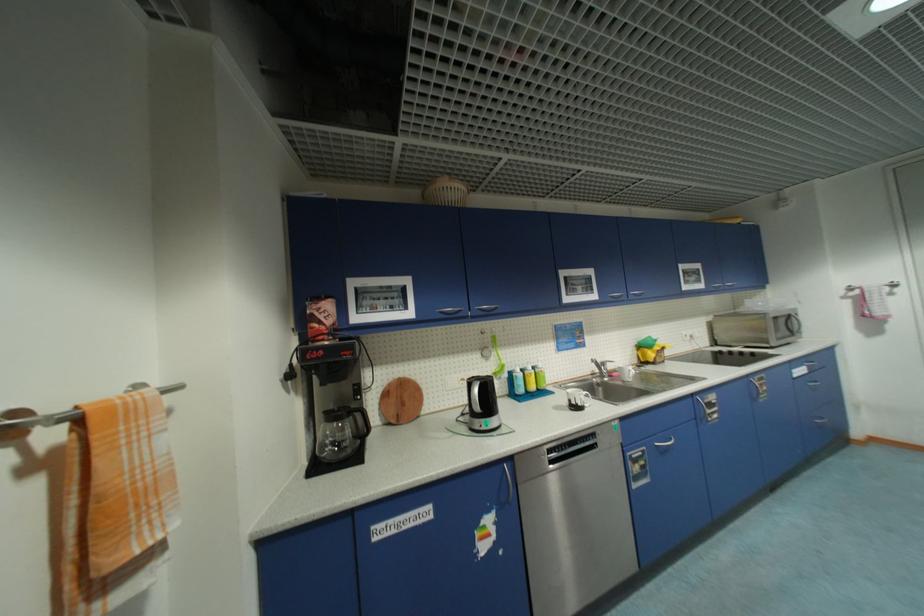
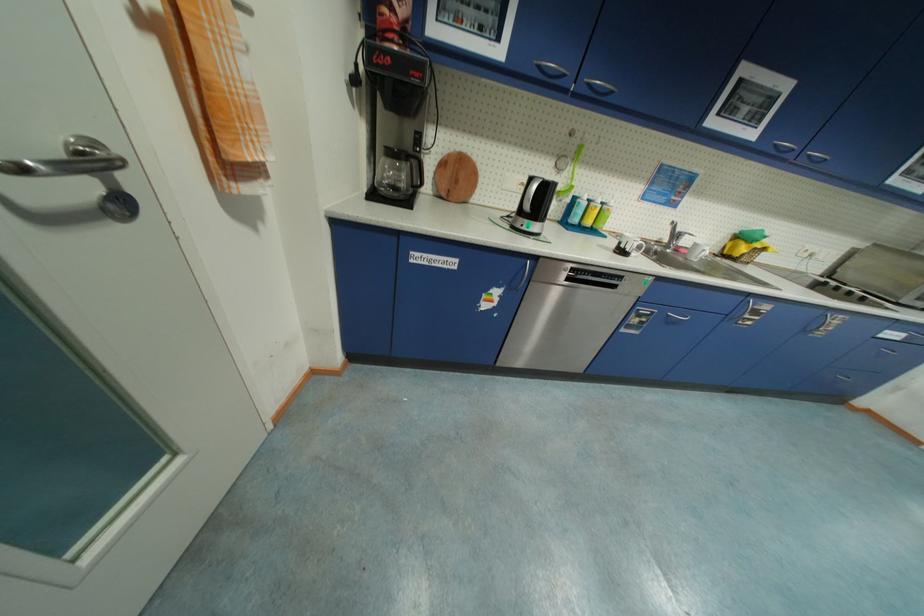
The point at (396, 381) is marked in the first image. Where is the corresponding point in the second image?

(457, 151)